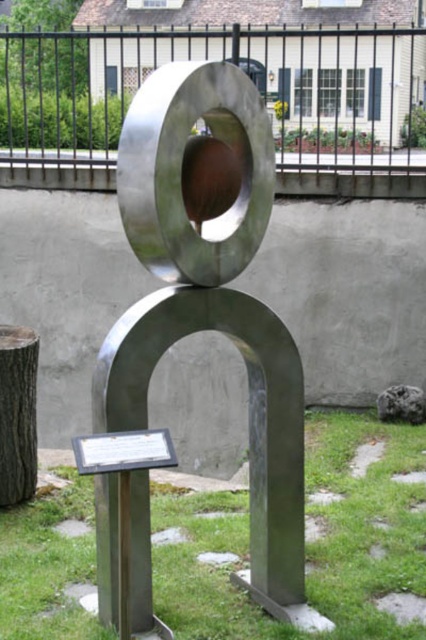
Is polished metal sculpture at center wider than green grass at center?

No.

This screenshot has width=426, height=640. I want to click on polished metal sculpture at center, so click(210, 292).

At what (x,y) coordinates should I click in order to perform the action: click on polished metal sculpture at center. Please return your answer as a coordinate pair (x, y). Looking at the image, I should click on tap(210, 292).

Which is above, green grass at center or dark brown wood stump at lower left?

dark brown wood stump at lower left

Between green grass at center and dark brown wood stump at lower left, which one appears on the right side from the viewer's perspective?

green grass at center is more to the right.

Is point (163, 618) farther from camera compared to point (2, 497)?

No.

This screenshot has height=640, width=426. Find the location of `green grass at center`. green grass at center is located at coordinates point(307,541).

Is polished metal sculpture at center smaller than dark brown wood stump at lower left?

No, polished metal sculpture at center is not smaller than dark brown wood stump at lower left.

Measure the distance between point (111, 554) and camera.

Point (111, 554) is 3.31 meters away from camera.

Between point (291, 499) and point (14, 410), which one is positioned in front?

Positioned in front is point (291, 499).

This screenshot has width=426, height=640. What are the coordinates of `polished metal sculpture at center` in the screenshot? It's located at (210, 292).